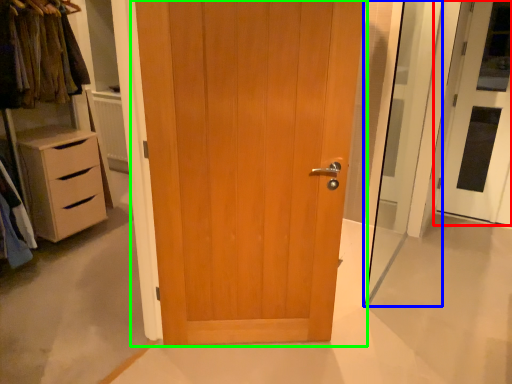
Question: Considering the real-world distances, which object is farthest from door (highlighted by a red box)? screen door (highlighted by a blue box) or door (highlighted by a green box)?

Choices:
 (A) screen door
 (B) door

Answer: (B)